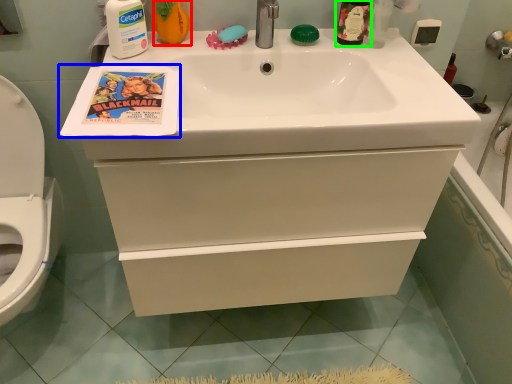
Question: Which is farther away from cleaning product (highlighted by a red box)? comic book (highlighted by a blue box) or mouthwash (highlighted by a green box)?

Choices:
 (A) comic book
 (B) mouthwash

Answer: (B)